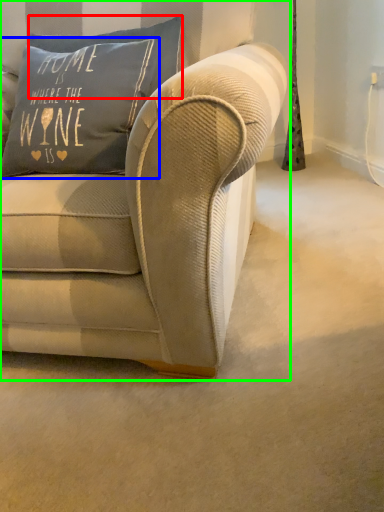
Question: Which is nearer to the pillow (highlighted by a red box)? pillow (highlighted by a blue box) or studio couch (highlighted by a green box).

Choices:
 (A) pillow
 (B) studio couch

Answer: (A)